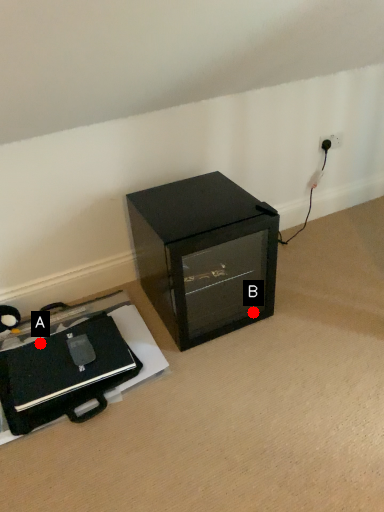
Question: Two points are circled on the image, labeled by A and B beside each circle. Among these points, which one is farthest from the camera?

Choices:
 (A) A is further
 (B) B is further

Answer: (B)